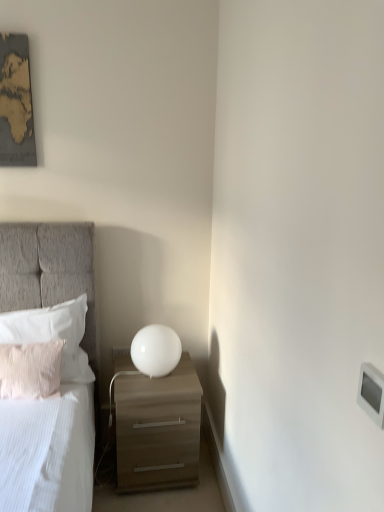
The width and height of the screenshot is (384, 512). What are the coordinates of `vacant space underneath white glossy sphere at center (from a real-world perspective)` in the screenshot? It's located at (153, 378).